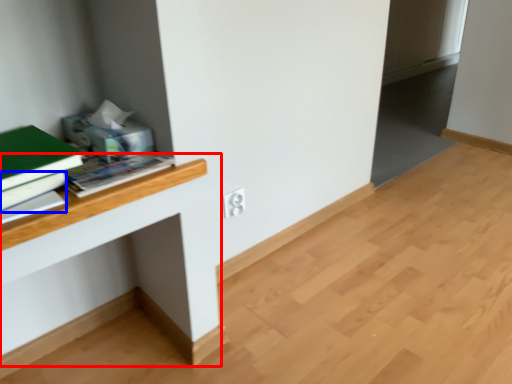
Question: Which object is closer to the camera taking this photo, computer desk (highlighted by a red box) or book (highlighted by a blue box)?

Choices:
 (A) computer desk
 (B) book

Answer: (B)